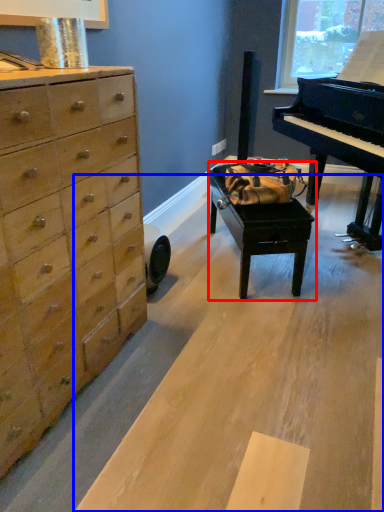
Question: Among these objects, which one is farthest to the camera, table (highlighted by a red box) or plywood (highlighted by a blue box)?

Choices:
 (A) table
 (B) plywood

Answer: (A)